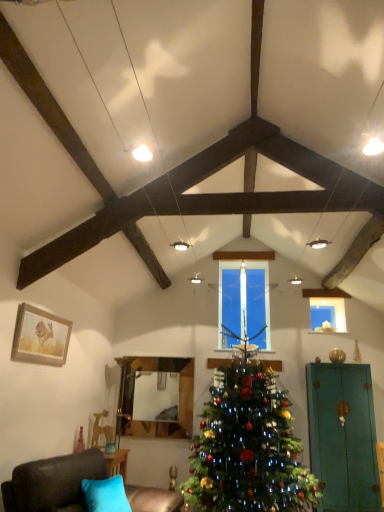
Locate an element on the screen. The width and height of the screenshot is (384, 512). clear glass candle at center is located at coordinates (244, 301).

The height and width of the screenshot is (512, 384). What do you see at coordinates (244, 301) in the screenshot? I see `clear glass candle at center` at bounding box center [244, 301].

What do you see at coordinates (343, 436) in the screenshot? I see `teal matte armoire at right` at bounding box center [343, 436].

Measure the distance between wooden framed picture at left and camera.

The depth of wooden framed picture at left is 10.66 feet.

This screenshot has width=384, height=512. What do you see at coordinates (248, 443) in the screenshot?
I see `green matte christmas tree at center` at bounding box center [248, 443].

Image resolution: width=384 pixels, height=512 pixels. What do you see at coordinates (322, 315) in the screenshot? I see `transparent glass candle at upper center` at bounding box center [322, 315].

Describe the element at coordinates (53, 483) in the screenshot. I see `dark brown leather couch at lower left` at that location.

What are the coordinates of `clear glass candle at center` in the screenshot? It's located at (244, 301).

From the image's perspective, does transparent glass candle at upper center appear higher than clear glass candle at center?

Actually, transparent glass candle at upper center appears below clear glass candle at center in the image.

Considering the positions of point (313, 327) and point (233, 314), is point (313, 327) closer or farther from the camera than point (233, 314)?

Point (313, 327).

Can you tell me how much transparent glass candle at upper center and clear glass candle at center differ in facing direction?

0.000536 degrees.

Is transparent glass candle at upper center in front of clear glass candle at center?

No, transparent glass candle at upper center is further to the viewer.

Which of these two, transparent glass candle at upper center or dark brown leather couch at lower left, is smaller?

transparent glass candle at upper center.

Based on the photo, is dark brown leather couch at lower left surrounded by transparent glass candle at upper center?

Actually, dark brown leather couch at lower left is outside transparent glass candle at upper center.

Consider the image. In terms of width, does transparent glass candle at upper center look wider or thinner when compared to dark brown leather couch at lower left?

In the image, transparent glass candle at upper center appears to be more narrow than dark brown leather couch at lower left.

From a real-world perspective, is transparent glass candle at upper center above or below dark brown leather couch at lower left?

transparent glass candle at upper center is situated higher than dark brown leather couch at lower left in the real world.

Is green matte christmas tree at center completely or partially inside wooden framed picture at left?

No.

Who is shorter, wooden framed picture at left or green matte christmas tree at center?

With less height is wooden framed picture at left.

From a real-world perspective, is wooden framed picture at left physically located above or below green matte christmas tree at center?

In terms of real-world spatial position, wooden framed picture at left is above green matte christmas tree at center.

How far apart are wooden framed picture at left and green matte christmas tree at center?

A distance of 7.53 feet exists between wooden framed picture at left and green matte christmas tree at center.

Does teal matte armoire at right have a greater width compared to transparent glass candle at upper center?

Yes, teal matte armoire at right is wider than transparent glass candle at upper center.

From the image's perspective, is teal matte armoire at right above transparent glass candle at upper center?

No, from the image's perspective, teal matte armoire at right is not above transparent glass candle at upper center.

Is teal matte armoire at right inside the boundaries of transparent glass candle at upper center, or outside?

teal matte armoire at right cannot be found inside transparent glass candle at upper center.

Where is `armoire that is below the transparent glass candle at upper center (from the image's perspective)`? armoire that is below the transparent glass candle at upper center (from the image's perspective) is located at coordinates (343, 436).

Is dark brown leather couch at lower left taller than transparent glass candle at upper center?

Correct, dark brown leather couch at lower left is much taller as transparent glass candle at upper center.

Is dark brown leather couch at lower left facing towards transparent glass candle at upper center?

No, dark brown leather couch at lower left is not turned towards transparent glass candle at upper center.

Based on the photo, from a real-world perspective, is dark brown leather couch at lower left on transparent glass candle at upper center?

Incorrect, from a real-world perspective, dark brown leather couch at lower left is lower than transparent glass candle at upper center.

Is point (84, 478) positioned behind point (317, 325)?

No, it is not.

Looking at this image, which is more to the left, clear glass candle at center or dark brown leather couch at lower left?

Positioned to the left is dark brown leather couch at lower left.

Is clear glass candle at center in front of or behind dark brown leather couch at lower left in the image?

Visually, clear glass candle at center is located behind dark brown leather couch at lower left.

Is clear glass candle at center next to dark brown leather couch at lower left and touching it?

No, clear glass candle at center is not with dark brown leather couch at lower left.

Considering the sizes of clear glass candle at center and dark brown leather couch at lower left in the image, is clear glass candle at center wider or thinner than dark brown leather couch at lower left?

Clearly, clear glass candle at center has less width compared to dark brown leather couch at lower left.

Considering the sizes of objects wooden framed picture at left and teal matte armoire at right in the image provided, who is taller, wooden framed picture at left or teal matte armoire at right?

teal matte armoire at right is taller.

Which is in front, point (19, 356) or point (336, 446)?

Positioned in front is point (19, 356).

The height and width of the screenshot is (512, 384). Identify the location of window that appears above the transparent glass candle at upper center (from a real-world perspective). (244, 301).

Identify the location of window screen behind the dark brown leather couch at lower left. coord(322,315).

When comparing their distances from clear glass candle at center, does green matte christmas tree at center or wooden framed picture at left seem closer?

Among the two, green matte christmas tree at center is located nearer to clear glass candle at center.

Looking at the image, which one is located further to clear glass candle at center, wooden framed picture at left or teal matte armoire at right?

The object further to clear glass candle at center is wooden framed picture at left.

Looking at the image, which one is located closer to green matte christmas tree at center, transparent glass candle at upper center or teal matte armoire at right?

The object closer to green matte christmas tree at center is teal matte armoire at right.

Based on their spatial positions, is green matte christmas tree at center or teal matte armoire at right closer to clear glass candle at center?

green matte christmas tree at center is positioned closer to the anchor clear glass candle at center.

Based on their spatial positions, is transparent glass candle at upper center or teal matte armoire at right further from dark brown leather couch at lower left?

transparent glass candle at upper center is further to dark brown leather couch at lower left.

From the image, which object appears to be nearer to transparent glass candle at upper center, green matte christmas tree at center or teal matte armoire at right?

Among the two, teal matte armoire at right is located nearer to transparent glass candle at upper center.

Estimate the real-world distances between objects in this image. Which object is closer to dark brown leather couch at lower left, green matte christmas tree at center or teal matte armoire at right?

Based on the image, green matte christmas tree at center appears to be nearer to dark brown leather couch at lower left.

Looking at this image, estimate the real-world distances between objects in this image. Which object is closer to clear glass candle at center, wooden framed picture at left or green matte christmas tree at center?

green matte christmas tree at center lies closer to clear glass candle at center than the other object.

Where is `studio couch between wooden framed picture at left and teal matte armoire at right`? This screenshot has height=512, width=384. studio couch between wooden framed picture at left and teal matte armoire at right is located at coordinates (53, 483).

Locate an element on the screen. The height and width of the screenshot is (512, 384). window located between dark brown leather couch at lower left and transparent glass candle at upper center in the depth direction is located at coordinates (244, 301).

I want to click on armoire located between green matte christmas tree at center and clear glass candle at center in the depth direction, so click(x=343, y=436).

Where is `studio couch situated between wooden framed picture at left and green matte christmas tree at center from left to right`? studio couch situated between wooden framed picture at left and green matte christmas tree at center from left to right is located at coordinates (53, 483).